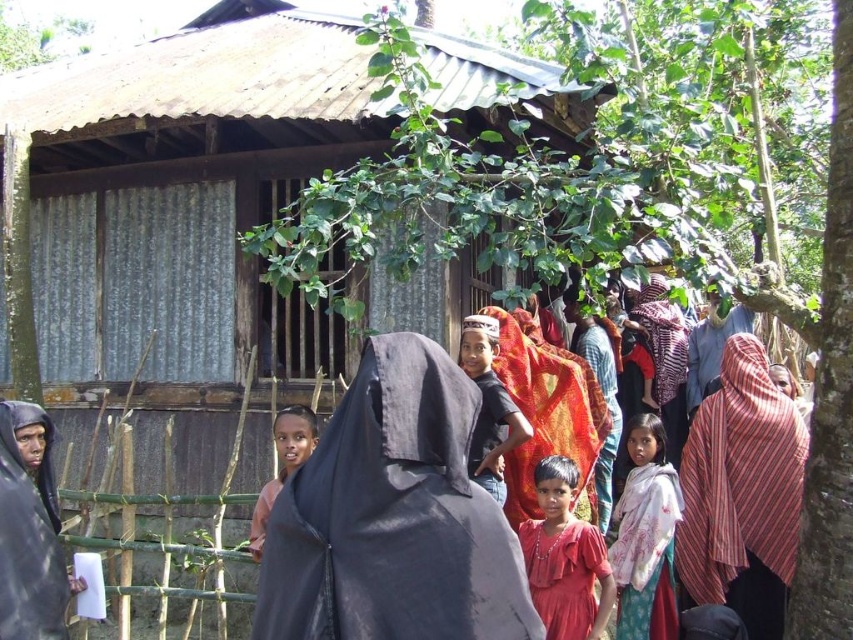
You are a photographer trying to capture a detailed shot of both the black matte veil at center and the striped fabric headscarf at center. Given that your camera can only focus on objects within a 1.2 meter width, will you be able to fit both items into the frame without cropping either?

The black matte veil at center is wider than the striped fabric headscarf at center. Since the camera requires a 1.2 meter width to focus on both, and the total width of both items combined may exceed this limit, it might not fit. However, without exact measurements, it is uncertain. The description only states the veil is wider, not the exact dimensions.

You are standing in front of the rustic house and want to determine the spatial relationship between two points marked in the scene. Which point, point (259, 625) or point (653, 605), is closer to you?

Point (259, 625) is closer to the viewer than point (653, 605).

You are a visitor at this rural gathering and want to take a photo of the black matte veil at center without including the corrugated metal hut at center in the frame. Which direction should you move to achieve this?

The corrugated metal hut at center is to the left of the black matte veil at center. To exclude the hut from the photo, move to the right side of the black matte veil at center so the hut is out of frame.